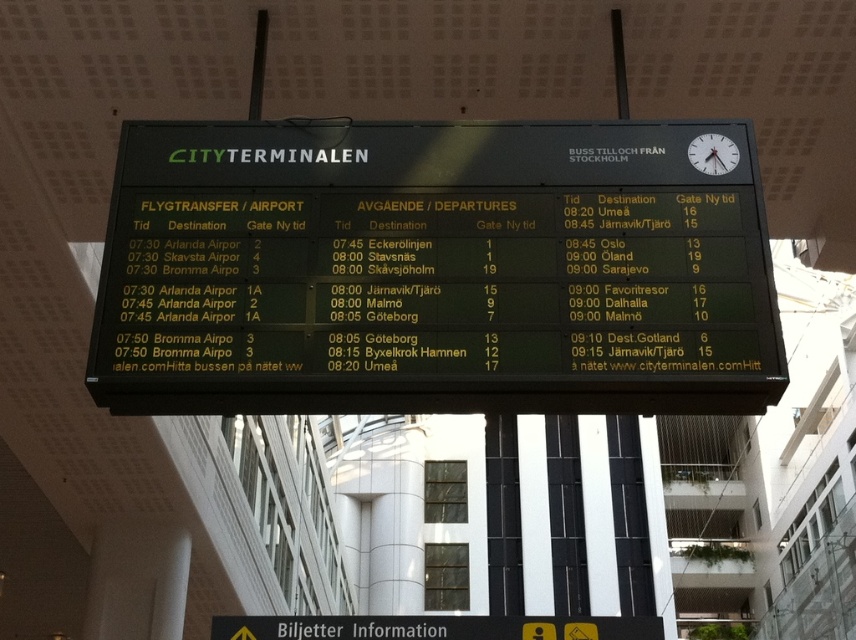
The image size is (856, 640). What do you see at coordinates (432, 272) in the screenshot?
I see `green plastic scoreboard at center` at bounding box center [432, 272].

Is green plastic scoreboard at center taller than white glossy clock at upper right?

Yes.

Between point (138, 221) and point (699, 154), which one is positioned behind?

The point (699, 154) is behind.

This screenshot has width=856, height=640. What are the coordinates of `green plastic scoreboard at center` in the screenshot? It's located at (432, 272).